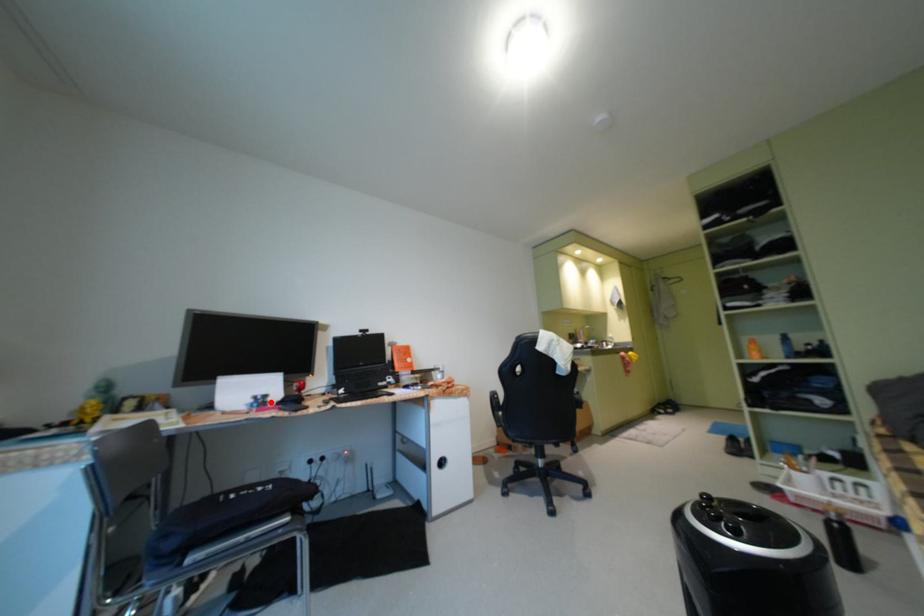
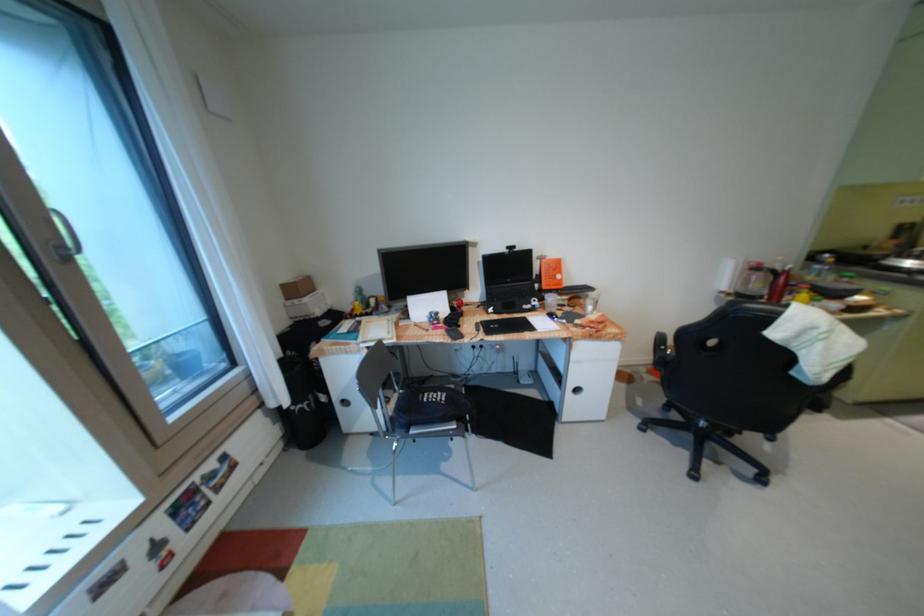
In the second image, find the point that corresponds to the highlighted location in the first image.

(444, 318)